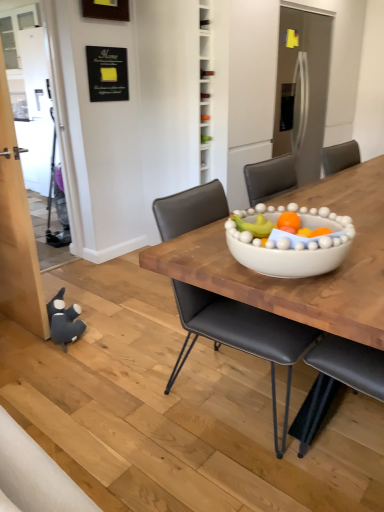
What do you see at coordinates (242, 335) in the screenshot? The height and width of the screenshot is (512, 384). I see `black leather chair at center` at bounding box center [242, 335].

I want to click on black leather chair at center, so click(242, 335).

The width and height of the screenshot is (384, 512). Describe the element at coordinates (64, 320) in the screenshot. I see `dark gray plush toy at lower left` at that location.

Find the location of a particular element. dark gray plush toy at lower left is located at coordinates (64, 320).

Where is `black leather chair at center`? Image resolution: width=384 pixels, height=512 pixels. black leather chair at center is located at coordinates (242, 335).

Considering the relative positions of black leather chair at center and dark gray plush toy at lower left in the image provided, is black leather chair at center to the left or to the right of dark gray plush toy at lower left?

black leather chair at center is to the right of dark gray plush toy at lower left.

Does black leather chair at center lie in front of dark gray plush toy at lower left?

Yes, black leather chair at center is closer to the camera.

Considering the points (203, 221) and (77, 307), which point is in front, point (203, 221) or point (77, 307)?

The point (203, 221) is closer to the camera.

From the image's perspective, is black leather chair at center above or below dark gray plush toy at lower left?

black leather chair at center is situated higher than dark gray plush toy at lower left in the image.

In the scene shown: From a real-world perspective, relative to dark gray plush toy at lower left, is black leather chair at center vertically above or below?

black leather chair at center is situated higher than dark gray plush toy at lower left in the real world.

Based on the photo, can you confirm if black leather chair at center is thinner than dark gray plush toy at lower left?

Incorrect, the width of black leather chair at center is not less than that of dark gray plush toy at lower left.

Considering the relative sizes of black leather chair at center and dark gray plush toy at lower left in the image provided, is black leather chair at center taller than dark gray plush toy at lower left?

Correct, black leather chair at center is much taller as dark gray plush toy at lower left.

Looking at the image, does black leather chair at center seem bigger or smaller compared to dark gray plush toy at lower left?

Considering their sizes, black leather chair at center takes up more space than dark gray plush toy at lower left.

Can we say black leather chair at center lies outside dark gray plush toy at lower left?

Absolutely, black leather chair at center is external to dark gray plush toy at lower left.

Are black leather chair at center and dark gray plush toy at lower left making contact?

No, black leather chair at center is not in contact with dark gray plush toy at lower left.

Is black leather chair at center facing towards dark gray plush toy at lower left?

No, black leather chair at center is not facing towards dark gray plush toy at lower left.

Image resolution: width=384 pixels, height=512 pixels. I want to click on toy that is below the black leather chair at center (from the image's perspective), so click(64, 320).

In the image, is dark gray plush toy at lower left on the left side or the right side of black leather chair at center?

dark gray plush toy at lower left is positioned on black leather chair at center's left side.

Considering the relative positions of dark gray plush toy at lower left and black leather chair at center in the image provided, is dark gray plush toy at lower left in front of black leather chair at center?

No, dark gray plush toy at lower left is further to the viewer.

Which is in front, point (68, 313) or point (186, 198)?

Point (186, 198)

From the image's perspective, which one is positioned higher, dark gray plush toy at lower left or black leather chair at center?

black leather chair at center, from the image's perspective.

From a real-world perspective, is dark gray plush toy at lower left positioned above or below black leather chair at center?

From a real-world perspective, dark gray plush toy at lower left is physically below black leather chair at center.

Looking at this image, considering the sizes of objects dark gray plush toy at lower left and black leather chair at center in the image provided, who is wider, dark gray plush toy at lower left or black leather chair at center?

black leather chair at center.

Considering the sizes of objects dark gray plush toy at lower left and black leather chair at center in the image provided, who is shorter, dark gray plush toy at lower left or black leather chair at center?

dark gray plush toy at lower left is shorter.

Considering the sizes of dark gray plush toy at lower left and black leather chair at center in the image, is dark gray plush toy at lower left bigger or smaller than black leather chair at center?

In the image, dark gray plush toy at lower left appears to be smaller than black leather chair at center.

Is dark gray plush toy at lower left not inside black leather chair at center?

Yes, dark gray plush toy at lower left is not within black leather chair at center.

Does dark gray plush toy at lower left touch black leather chair at center?

No, dark gray plush toy at lower left is not making contact with black leather chair at center.

Is black leather chair at center at the back of dark gray plush toy at lower left?

No, dark gray plush toy at lower left is not facing away from black leather chair at center.

The image size is (384, 512). I want to click on chair above the dark gray plush toy at lower left (from a real-world perspective), so click(x=242, y=335).

Locate an element on the screen. The image size is (384, 512). toy below the black leather chair at center (from the image's perspective) is located at coordinates (64, 320).

Find the location of a particular element. toy on the left side of black leather chair at center is located at coordinates (64, 320).